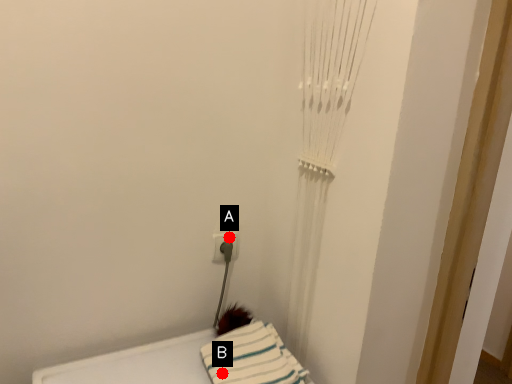
Question: Two points are circled on the image, labeled by A and B beside each circle. Among these points, which one is farthest from the camera?

Choices:
 (A) A is further
 (B) B is further

Answer: (A)